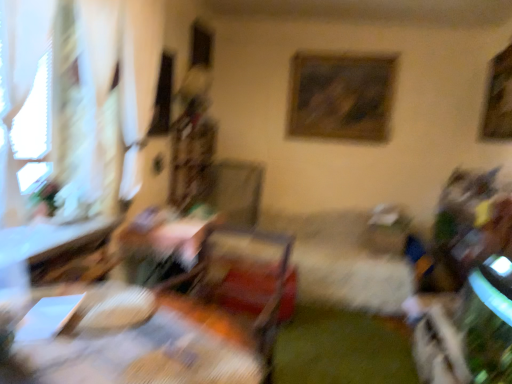
Image resolution: width=512 pixels, height=384 pixels. I want to click on free point above wooden framed painting at upper center, which appears as the second picture frame when viewed from the front (from a real-world perspective), so (346, 50).